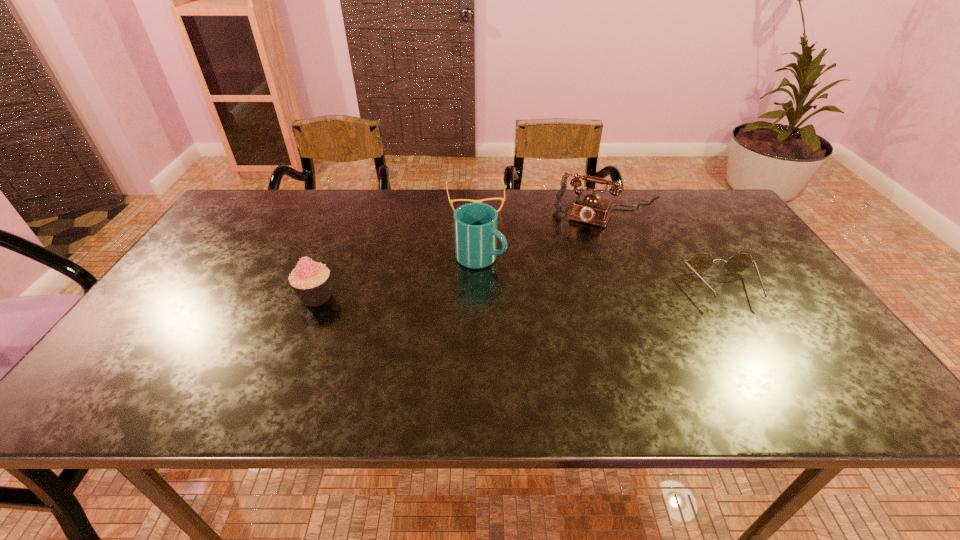
Locate an element on the screen. The image size is (960, 540). blank space located on the handle side of the cup is located at coordinates (539, 278).

Find the location of a particular element. This screenshot has width=960, height=540. vacant space located 0.320m on the handle side of the cup is located at coordinates (616, 308).

The height and width of the screenshot is (540, 960). I want to click on vacant space located on the dial of the telephone, so click(x=570, y=277).

Where is `free space located on the dial of the telephone`? free space located on the dial of the telephone is located at coordinates click(x=582, y=254).

I want to click on vacant area located 0.150m on the dial of the telephone, so click(581, 256).

What are the coordinates of `free space located 0.200m in front of the lenses of the shorter spectacles` in the screenshot? It's located at (482, 255).

The height and width of the screenshot is (540, 960). I want to click on vacant space located in front of the lenses of the shorter spectacles, so click(x=487, y=291).

This screenshot has width=960, height=540. In order to click on free location located in front of the lenses of the shorter spectacles in this screenshot , I will do [487, 294].

The width and height of the screenshot is (960, 540). Identify the location of telephone that is at the far edge. (590, 208).

I want to click on spectacles that is at the far edge, so click(503, 199).